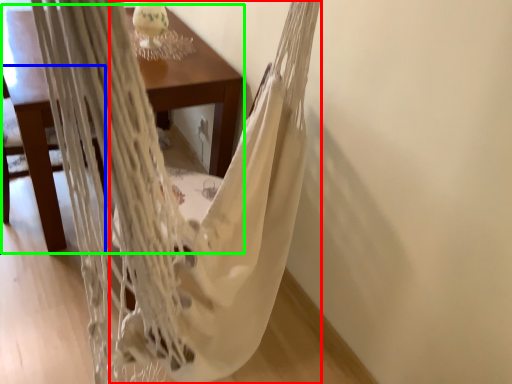
Question: Based on their relative distances, which object is farther from blanket (highlighted by a red box)? Choose from armchair (highlighted by a blue box) and table (highlighted by a green box).

Choices:
 (A) armchair
 (B) table

Answer: (A)